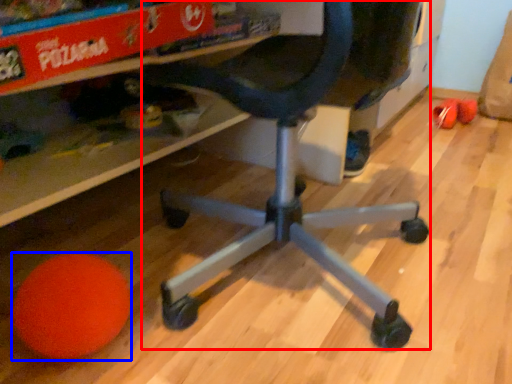
Question: Which object appears farthest to the camera in this image, computer chair (highlighted by a red box) or ball (highlighted by a blue box)?

Choices:
 (A) computer chair
 (B) ball

Answer: (B)